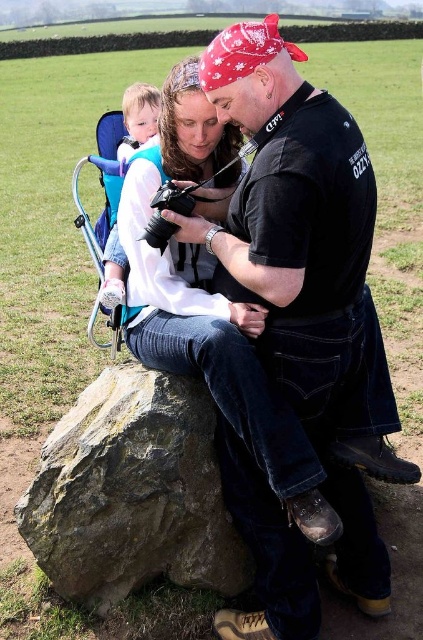
Question: From the image, what is the correct spatial relationship of brown rough rock at center in relation to light blue fabric carrier at upper left?

Choices:
 (A) right
 (B) left

Answer: (A)

Question: Which is farther from the light blue fabric carrier at upper left?

Choices:
 (A) black leather jacket at center
 (B) brown rough rock at center

Answer: (A)

Question: Which point is closer to the camera taking this photo?

Choices:
 (A) (162, 520)
 (B) (150, 129)

Answer: (A)

Question: Can you confirm if brown rough rock at center is positioned above light blue fabric carrier at upper left?

Choices:
 (A) yes
 (B) no

Answer: (B)

Question: Can you confirm if black leather jacket at center is positioned above brown rough rock at center?

Choices:
 (A) no
 (B) yes

Answer: (B)

Question: Which point is closer to the camera?

Choices:
 (A) brown rough rock at center
 (B) light blue fabric carrier at upper left

Answer: (A)